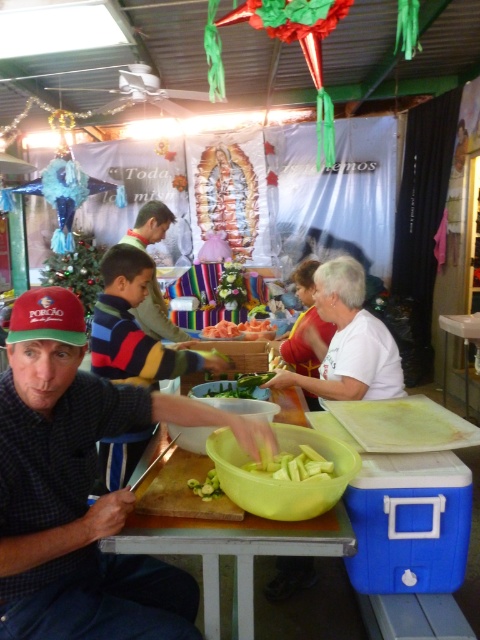
Does white matte shirt at center lie behind striped sweater at center?

No.

Between point (360, 384) and point (142, 216), which one is positioned behind?

The point (142, 216) is behind.

Find the location of `white matte shirt at center`. white matte shirt at center is located at coordinates (348, 340).

Can you confirm if red cap at left is positioned to the left of orange fleshed fruit at center?

Indeed, red cap at left is positioned on the left side of orange fleshed fruit at center.

Find the location of a particular element. red cap at left is located at coordinates (80, 488).

Is point (273, 332) in front of point (207, 496)?

No, it is behind (207, 496).

Is orange fleshed fruit at center above green matte cucumber at center?

Correct, orange fleshed fruit at center is located above green matte cucumber at center.

Who is more distant from viewer, (242, 337) or (219, 493)?

The point (242, 337) is more distant.

Find the location of `orange fleshed fruit at center`. orange fleshed fruit at center is located at coordinates (241, 330).